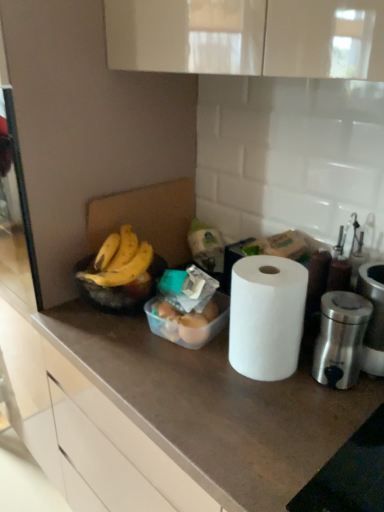
You are a GUI agent. You are given a task and a screenshot of the screen. Output one action in this format:
    pyautogui.click(x=<x>, y=<y>)
    Task: Click on the vacant space in front of black plastic bowl at left
    
    Given the screenshot: What is the action you would take?
    pyautogui.click(x=123, y=350)